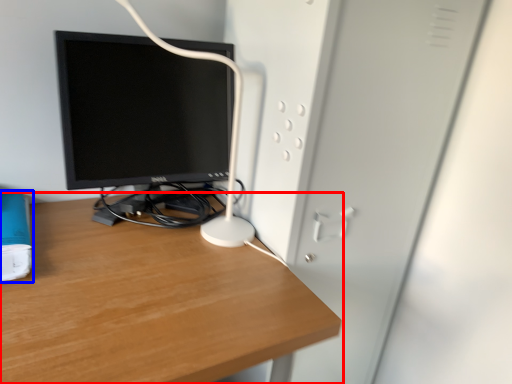
Question: Among these objects, which one is nearest to the camera, desk (highlighted by a red box) or paperback book (highlighted by a blue box)?

Choices:
 (A) desk
 (B) paperback book

Answer: (A)